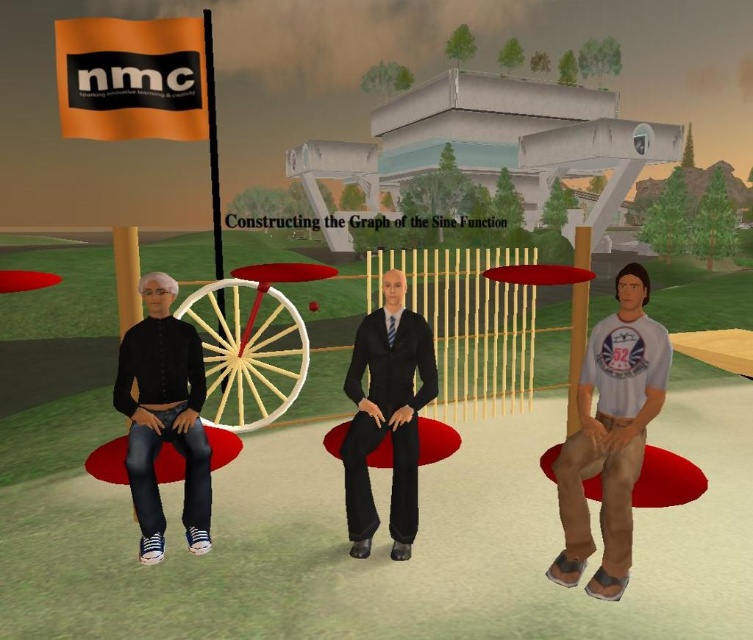
Question: In this image, where is white cotton t-shirt at right located relative to matte black suit at center?

Choices:
 (A) left
 (B) right

Answer: (B)

Question: Among these points, which one is nearest to the camera?

Choices:
 (A) (608, 436)
 (B) (392, 374)
 (C) (171, 419)

Answer: (A)

Question: Which object is the farthest from the matte black suit at center?

Choices:
 (A) white cotton t-shirt at right
 (B) black matte jeans at left

Answer: (B)

Question: Is black matte jeans at left smaller than matte black suit at center?

Choices:
 (A) no
 (B) yes

Answer: (A)

Question: Is the position of white cotton t-shirt at right less distant than that of matte black suit at center?

Choices:
 (A) no
 (B) yes

Answer: (B)

Question: Which of the following is the farthest from the observer?

Choices:
 (A) (154, 440)
 (B) (642, 378)
 (C) (364, 412)

Answer: (C)